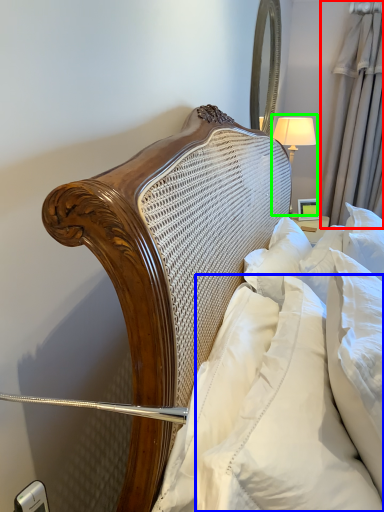
Question: Which object is the closest to the curtain (highlighted by a red box)? Choose among these: pillow (highlighted by a blue box) or bedside lamp (highlighted by a green box).

Choices:
 (A) pillow
 (B) bedside lamp

Answer: (B)